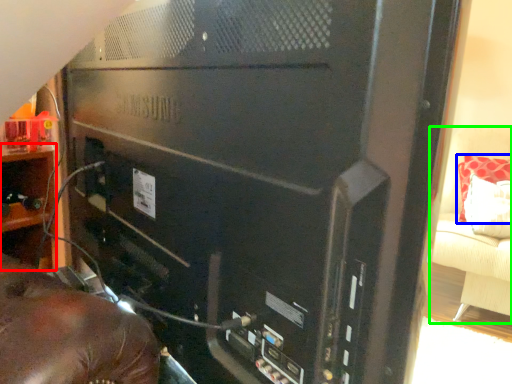
Question: Which object is the closest to the shelf (highlighted by a red box)? Choose among these: pillow (highlighted by a blue box) or furniture (highlighted by a green box).

Choices:
 (A) pillow
 (B) furniture

Answer: (B)